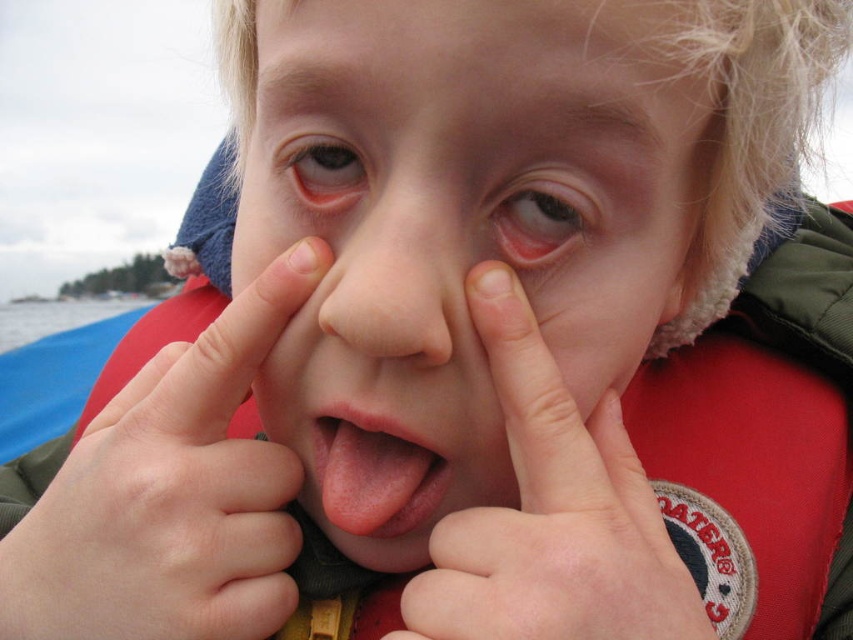
You are a photographer trying to capture a candid shot of the child in the image. The focus point of your camera is set to the point at coordinates point (x=524, y=250). If the recommended focus distance for sharp photos is at least 30 centimeters, will this point be in focus?

The point (x=524, y=250) is 35.08 centimeters from the camera, which exceeds the recommended 30 centimeters distance, so the focus point will be in focus.

You are a photographer trying to capture a candid shot of the child in the scene. The camera is positioned at a certain distance from the child. If you want to ensure the photo includes the entire red life jacket with the logo, should you move closer or farther away from the point at coordinates point (566, 253)?

Since the camera is 35.21 centimeters away from the point at coordinates point (566, 253), moving closer would allow you to capture more details of the child and the life jacket, but to ensure the entire life jacket is included, you might need to adjust your position based on the jacket size. However, without knowing the jacket size, it is difficult to determine the exact distance required. However, since the question is about the point and camera distance, the answer should focus on that. Wait, the point